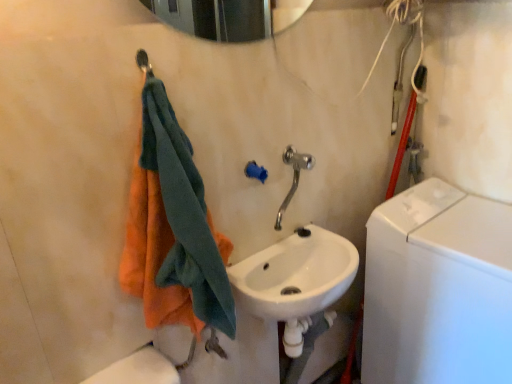
Question: Is white glossy washing machine at right located within white glossy sink at center?

Choices:
 (A) yes
 (B) no

Answer: (B)

Question: Is white glossy sink at center bigger than white glossy washing machine at right?

Choices:
 (A) no
 (B) yes

Answer: (A)

Question: Does white glossy sink at center lie in front of white glossy washing machine at right?

Choices:
 (A) yes
 (B) no

Answer: (A)

Question: Is white glossy sink at center wider than white glossy washing machine at right?

Choices:
 (A) no
 (B) yes

Answer: (A)

Question: Does white glossy sink at center touch white glossy washing machine at right?

Choices:
 (A) no
 (B) yes

Answer: (A)

Question: From the image's perspective, is white glossy sink at center under white glossy washing machine at right?

Choices:
 (A) no
 (B) yes

Answer: (A)

Question: Does polished chrome faucet at center have a smaller size compared to white glossy sink at center?

Choices:
 (A) no
 (B) yes

Answer: (B)

Question: Is the position of polished chrome faucet at center less distant than that of white glossy sink at center?

Choices:
 (A) no
 (B) yes

Answer: (A)

Question: Is polished chrome faucet at center facing away from white glossy sink at center?

Choices:
 (A) no
 (B) yes

Answer: (A)

Question: Can you confirm if polished chrome faucet at center is thinner than white glossy sink at center?

Choices:
 (A) no
 (B) yes

Answer: (B)

Question: Is polished chrome faucet at center behind white glossy sink at center?

Choices:
 (A) yes
 (B) no

Answer: (A)

Question: Are polished chrome faucet at center and white glossy sink at center far apart?

Choices:
 (A) no
 (B) yes

Answer: (A)

Question: Is metallic silver shower at upper left at the back of white glossy washing machine at right?

Choices:
 (A) yes
 (B) no

Answer: (B)